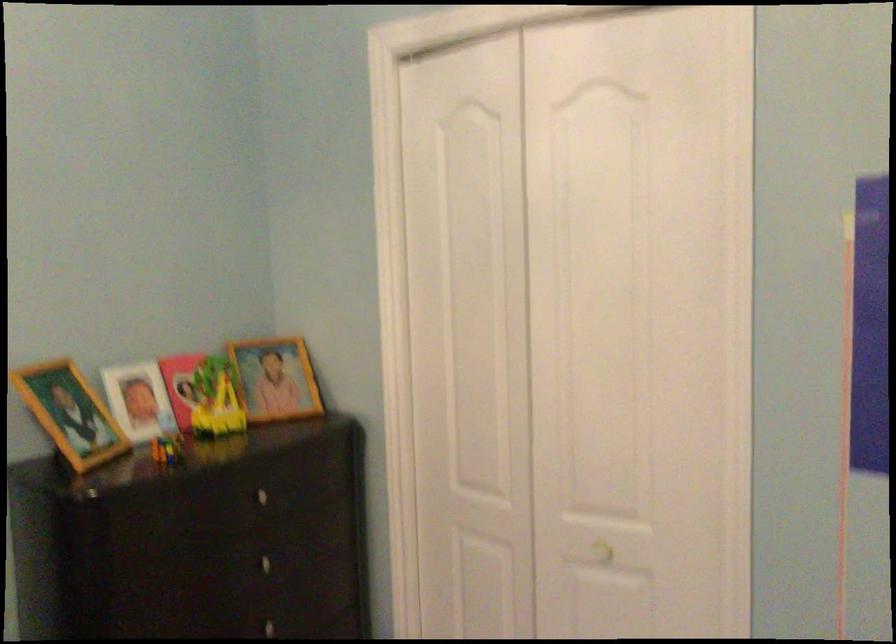
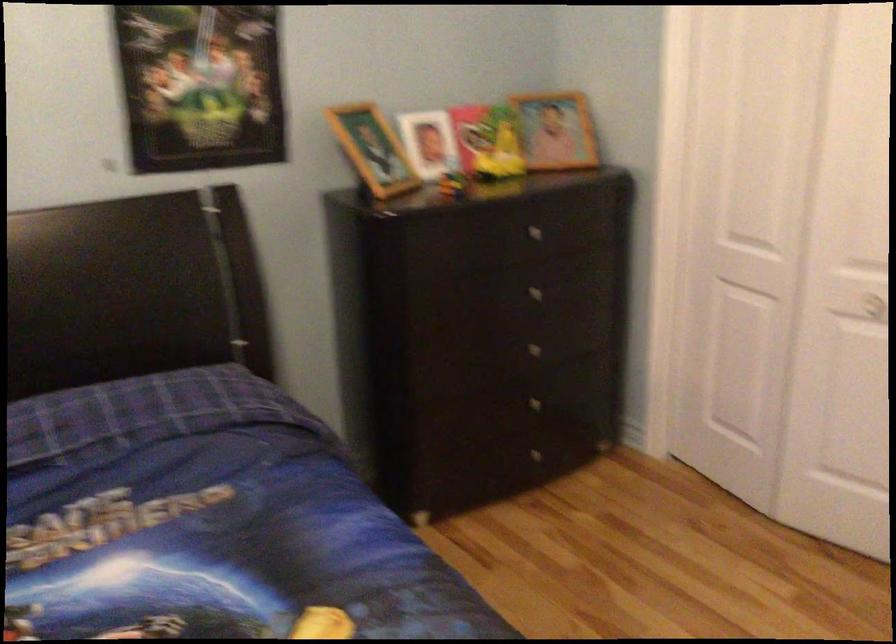
In the second image, find the point that corresponds to [207,399] in the first image.

(487, 142)